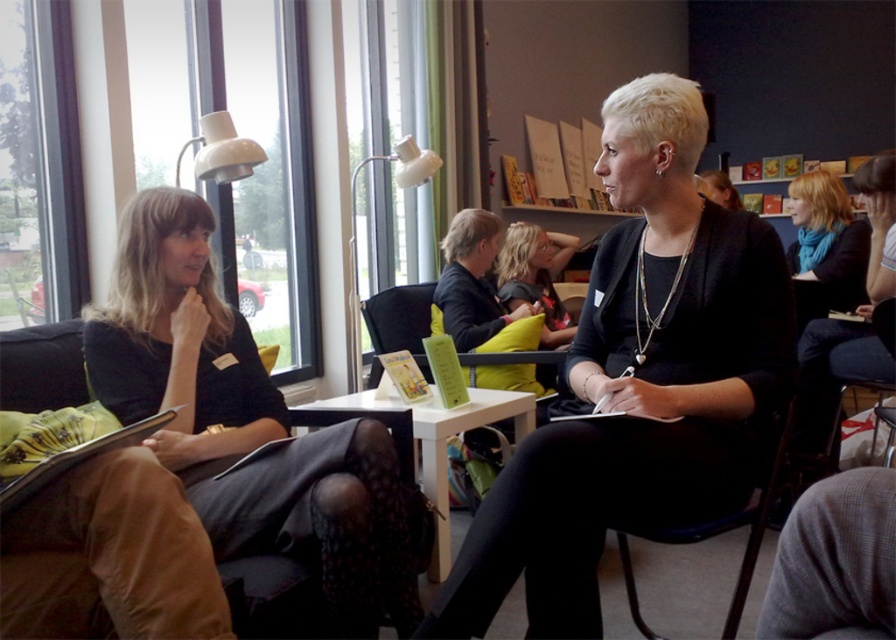
You are standing in the room and want to place a decorative vase on the white glossy table at center. However, there is a person with blonde hair at center in your way. Based on their positions, can you walk directly to the table without moving around the person?

The white glossy table at center is closer to the viewer than blonde hair at center, so you can walk directly to the white glossy table at center without needing to move around the person since the table is in front of them.

You are a photographer trying to capture a candid shot of the two women at the table. You notice the blonde hair scarf at upper right and the black plastic chair at center. Which object is positioned higher in the frame?

The blonde hair scarf at upper right is positioned higher in the frame than the black plastic chair at center.